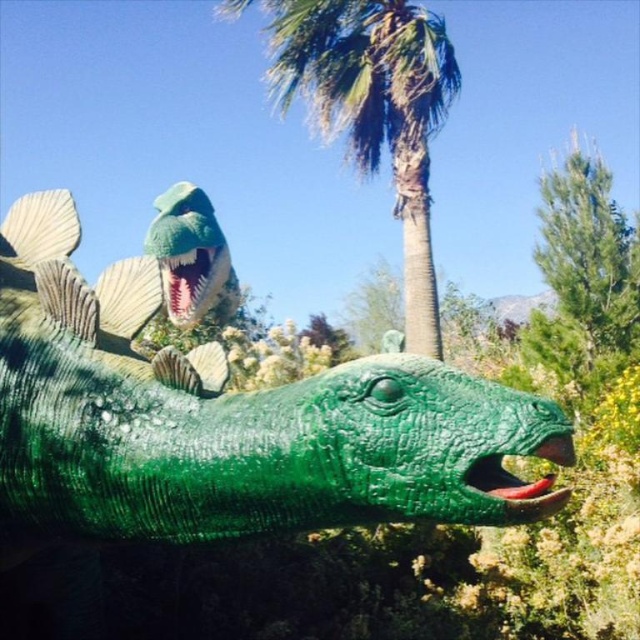
You are a visitor in the park and want to take a photo of the green glossy statue at center and the green textured palm tree at upper center. Which object should you focus on first if you want to capture both in the same frame without moving your camera?

The green glossy statue at center should be focused on first because it is shorter than the green textured palm tree at upper center, so adjusting focus to the closer object ensures both can be in the frame.

You are standing in the park and want to take a photo of the dinosaur model. The camera you are using has a focal length of 50mm and a sensor size of 24mm x 36mm. If you want to capture the entire dinosaur model in your photo without any cropping, what is the minimum distance you should maintain from the point at coordinate point [182,497] to ensure the dinosaur fits within the frame?

The point at coordinate point [182,497] is 1.74 meters from the viewer. To ensure the dinosaur fits within the frame, you should maintain a distance of at least 1.74 meters from that point.

You are standing at the entrance of the park and want to locate the green glossy statue at center. According to the coordinates provided, in which direction should you walk from your current position to reach it?

The green glossy statue at center is located at coordinates point (228, 419). Since you are at the entrance, you should walk towards the direction of the center of the park to reach it.